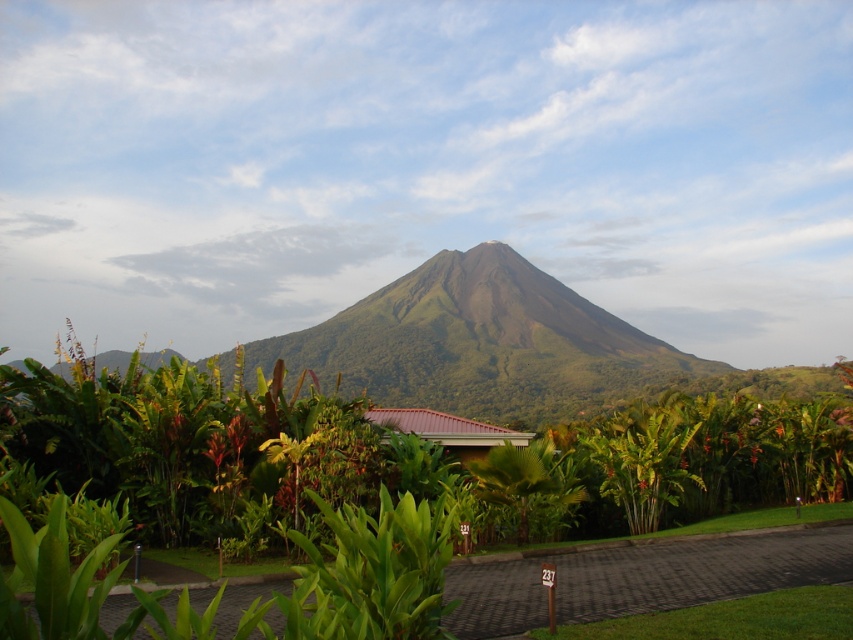
You are standing at the entrance of the tropical garden and see the green leafy tree at center. If you walk straight ahead, will you reach the tree before the volcano?

The position of green leafy tree at center is at point (x=398, y=454), which is closer to the entrance than the volcano in the background. Therefore, you will reach the green leafy tree at center before the volcano.

You are planning to plant a new tree in your garden. You have two options from the image shown. Which tree, the green leafy tree at center or the green leafy palm tree at center, should you choose if you want a taller tree in your garden?

The green leafy tree at center has a greater height compared to the green leafy palm tree at center, so you should choose the green leafy tree at center for a taller tree in your garden.